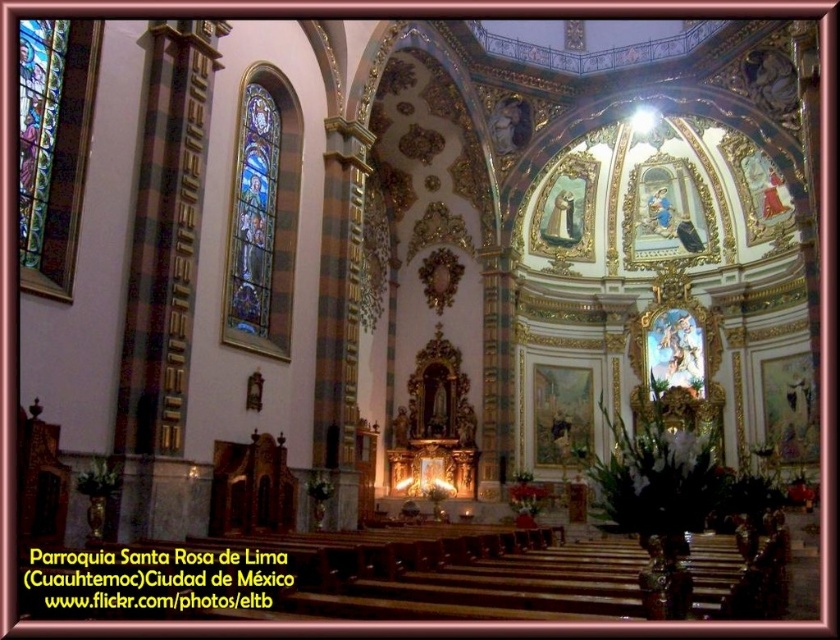
Question: Is the position of stained glass at left less distant than that of stained glass window at left?

Choices:
 (A) no
 (B) yes

Answer: (A)

Question: In this image, where is stained glass at left located relative to stained glass window at left?

Choices:
 (A) right
 (B) left

Answer: (A)

Question: Which object appears closest to the camera in this image?

Choices:
 (A) stained glass window at left
 (B) stained glass at left

Answer: (A)

Question: Which point appears closest to the camera in this image?

Choices:
 (A) (55, 97)
 (B) (290, 259)

Answer: (A)

Question: Does stained glass at left have a smaller size compared to stained glass window at left?

Choices:
 (A) no
 (B) yes

Answer: (A)